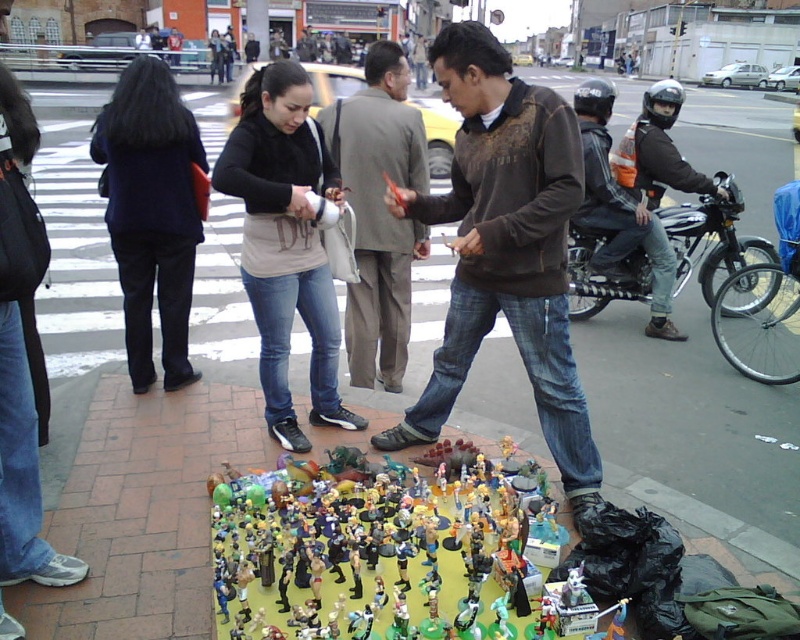
Question: Which of the following is the farthest from the observer?

Choices:
 (A) brown textured sweater at center
 (B) light brown textured suit at center

Answer: (B)

Question: Can you confirm if brown textured sweater at center is smaller than light brown textured suit at center?

Choices:
 (A) yes
 (B) no

Answer: (B)

Question: Does brown textured sweater at center appear over light brown textured suit at center?

Choices:
 (A) no
 (B) yes

Answer: (A)

Question: Does brown textured sweater at center have a lesser width compared to light brown textured suit at center?

Choices:
 (A) yes
 (B) no

Answer: (B)